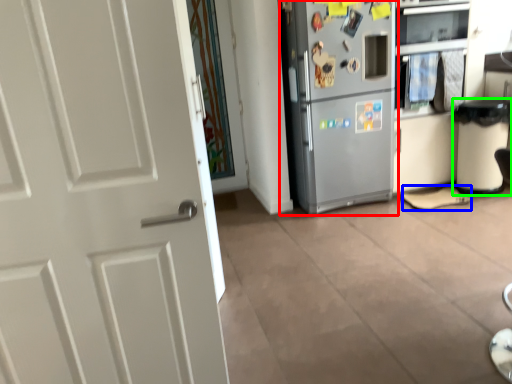
Question: Which is nearer to the refrigerator (highlighted by a red box)? shoe (highlighted by a blue box) or trash bin/can (highlighted by a green box).

Choices:
 (A) shoe
 (B) trash bin/can

Answer: (A)